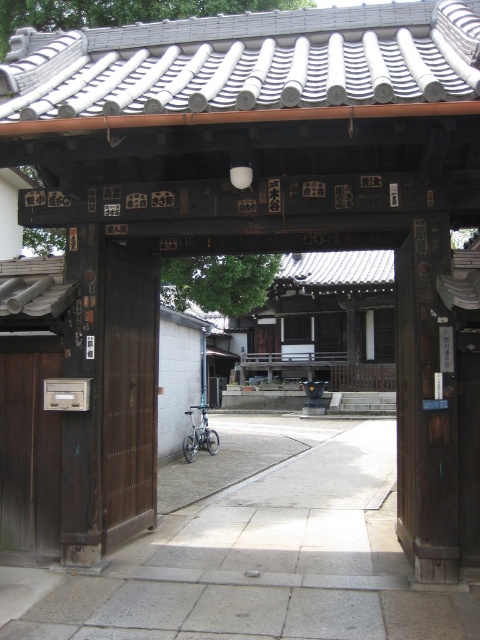
Question: Which point is closer to the camera taking this photo?

Choices:
 (A) (39, 522)
 (B) (104, 429)

Answer: (A)

Question: Observing the image, what is the correct spatial positioning of gray concrete pavement at center in reference to dark brown wood door at left?

Choices:
 (A) above
 (B) below

Answer: (B)

Question: Can you confirm if gray concrete pavement at center is positioned above dark brown wood door at left?

Choices:
 (A) no
 (B) yes

Answer: (A)

Question: Which of these objects is positioned closest to the dark brown wood door at left?

Choices:
 (A) gray concrete pavement at center
 (B) brown wooden door at center

Answer: (B)

Question: Does gray concrete pavement at center have a larger size compared to brown wooden door at center?

Choices:
 (A) yes
 (B) no

Answer: (A)

Question: Among these points, which one is nearest to the camera?

Choices:
 (A) (251, 536)
 (B) (144, 506)
 (C) (43, 554)

Answer: (C)